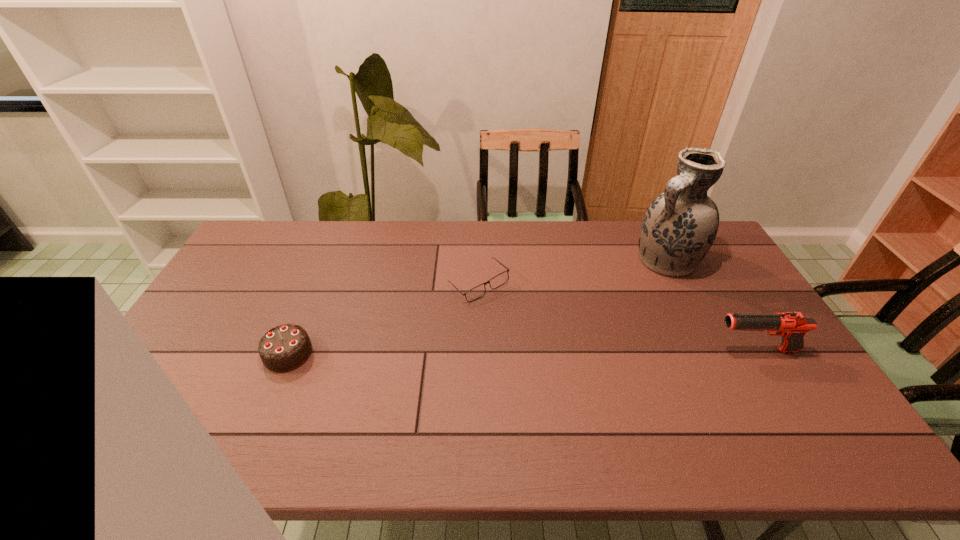
The height and width of the screenshot is (540, 960). In the image, there is a desktop. In order to click on free space at the far edge in this screenshot , I will do `click(374, 250)`.

You are a GUI agent. You are given a task and a screenshot of the screen. Output one action in this format:
    pyautogui.click(x=<x>, y=<y>)
    Task: Click on the vacant area at the near edge of the desktop
    This screenshot has width=960, height=540.
    Given the screenshot: What is the action you would take?
    pyautogui.click(x=608, y=413)

In the image, there is a desktop. Identify the location of vacant space at the left edge. The height and width of the screenshot is (540, 960). (203, 355).

The image size is (960, 540). In the image, there is a desktop. In order to click on free space at the far left corner in this screenshot , I will do `click(257, 245)`.

At what (x,y) coordinates should I click in order to perform the action: click on free space between the third shortest object and the spectacles. Please return your answer as a coordinate pair (x, y). Looking at the image, I should click on (617, 318).

Locate an element on the screen. vacant area that lies between the second object from left to right and the tallest object is located at coordinates (573, 273).

Identify the location of vacant area between the gun and the third object from right to left. This screenshot has width=960, height=540. (617, 318).

Find the location of `free space between the shortest object and the gun`. free space between the shortest object and the gun is located at coordinates tap(617, 318).

You are a GUI agent. You are given a task and a screenshot of the screen. Output one action in this format:
    pyautogui.click(x=<x>, y=<y>)
    Task: Click on the free space that is in between the gun and the leftmost object
    
    Given the screenshot: What is the action you would take?
    pyautogui.click(x=522, y=352)

The image size is (960, 540). Find the location of `free spot between the vase and the second shortest object`. free spot between the vase and the second shortest object is located at coordinates pyautogui.click(x=478, y=307).